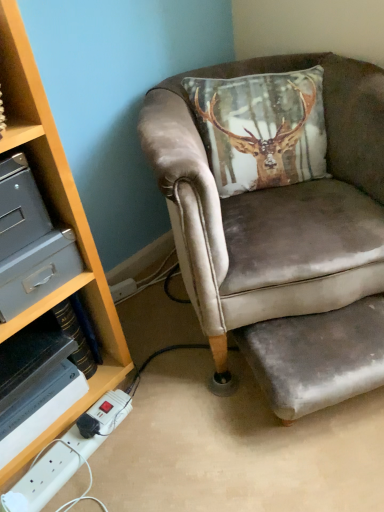
I want to click on vacant space in front of velvet grey footrest at lower right, so click(x=331, y=462).